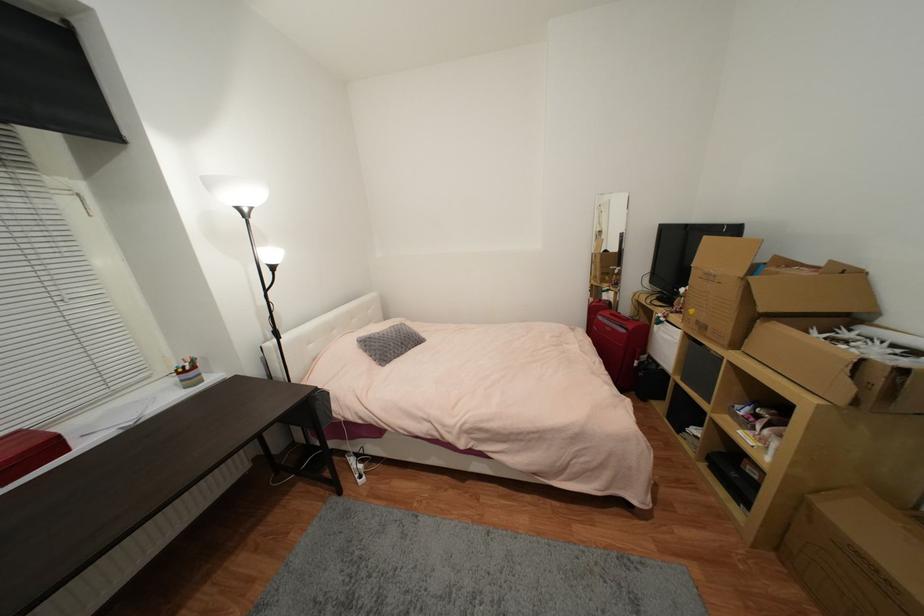
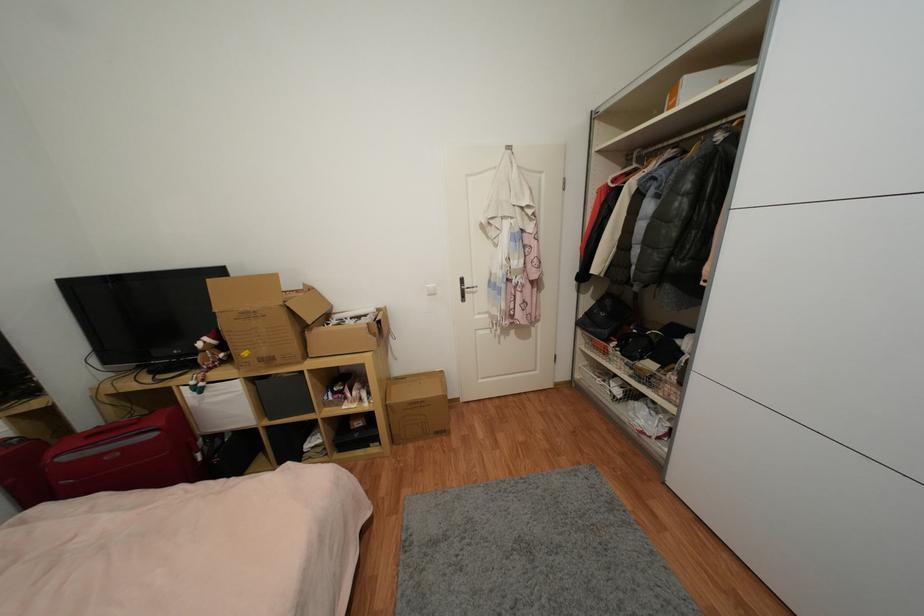
In the second image, find the point that corresponds to (x=708, y=329) in the first image.

(274, 361)